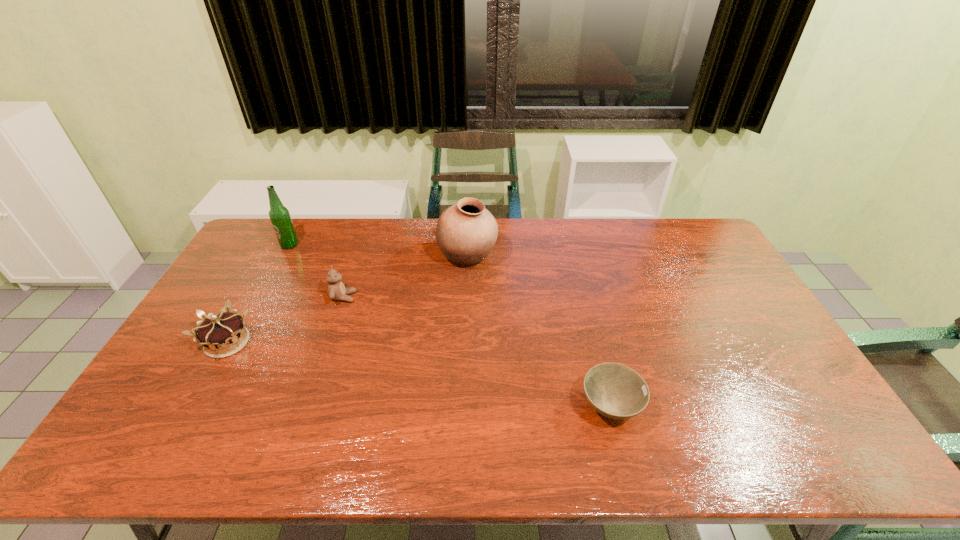
This screenshot has width=960, height=540. Find the location of `free space at the right edge of the desktop`. free space at the right edge of the desktop is located at coordinates click(742, 322).

Identify the location of free point at the far left corner. (263, 225).

At what (x,y) coordinates should I click in order to perform the action: click on unoccupied position between the shortest object and the crown. Please return your answer as a coordinate pair (x, y). This screenshot has width=960, height=540. Looking at the image, I should click on (419, 375).

The width and height of the screenshot is (960, 540). Identify the location of free space between the rightmost object and the pottery. (539, 332).

What are the coordinates of `vacant area that lies between the crown and the third farthest object` in the screenshot? It's located at (285, 320).

Locate an element on the screen. vacant space that is in between the fourth object from left to right and the third nearest object is located at coordinates (405, 278).

This screenshot has width=960, height=540. I want to click on vacant space that's between the beer bottle and the second object from right to left, so click(378, 251).

Locate an element on the screen. The height and width of the screenshot is (540, 960). vacant area that lies between the fourth object from left to right and the nearest object is located at coordinates (539, 332).

Where is `free point between the third nearest object and the beer bottle`? The width and height of the screenshot is (960, 540). free point between the third nearest object and the beer bottle is located at coordinates (317, 271).

Locate an element on the screen. This screenshot has height=540, width=960. free spot between the fourth object from left to right and the teddy bear is located at coordinates (405, 278).